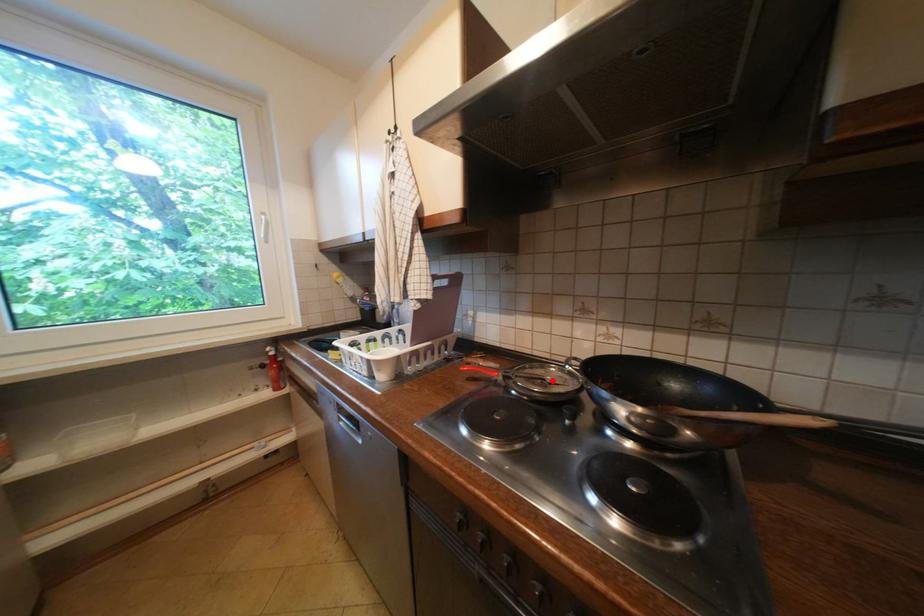
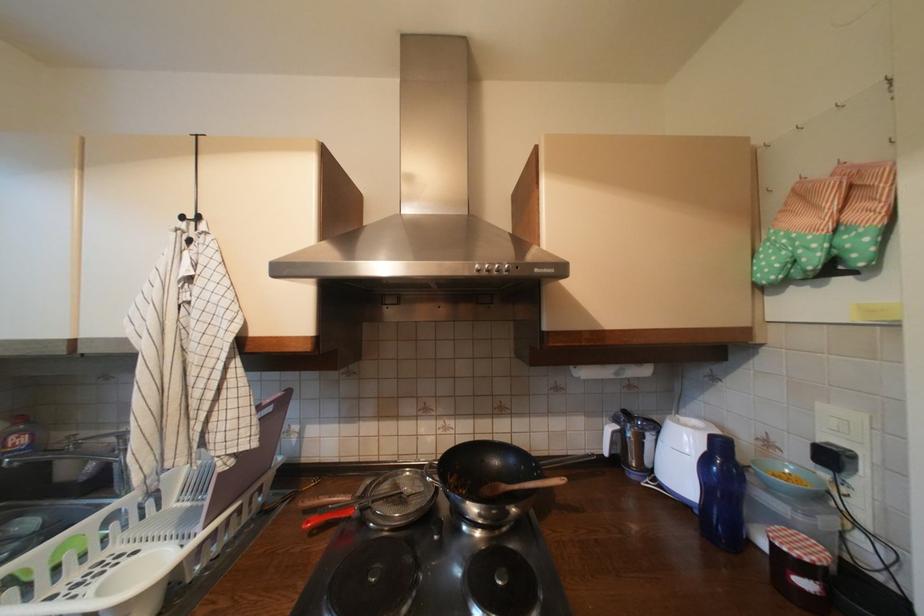
Where in the second image is the point corresponding to the highlighted location from the first image?

(410, 495)